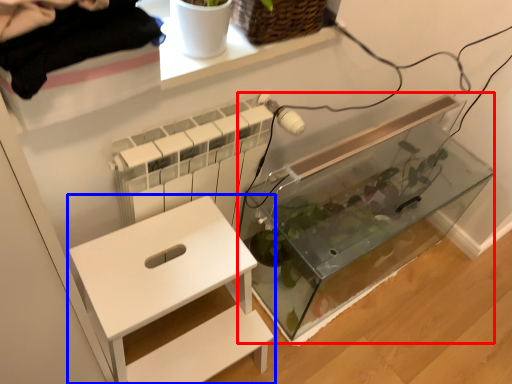
Question: Which of the following is the closest to the observer, glass box (highlighted by a red box) or furniture (highlighted by a blue box)?

Choices:
 (A) glass box
 (B) furniture

Answer: (B)